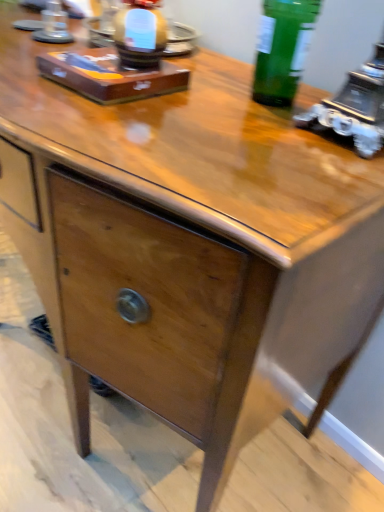
At what (x,y) coordinates should I click in order to perform the action: click on free space in front of green glass bottle at upper right. Please return your answer as a coordinate pair (x, y). This screenshot has width=384, height=512. Looking at the image, I should click on (265, 146).